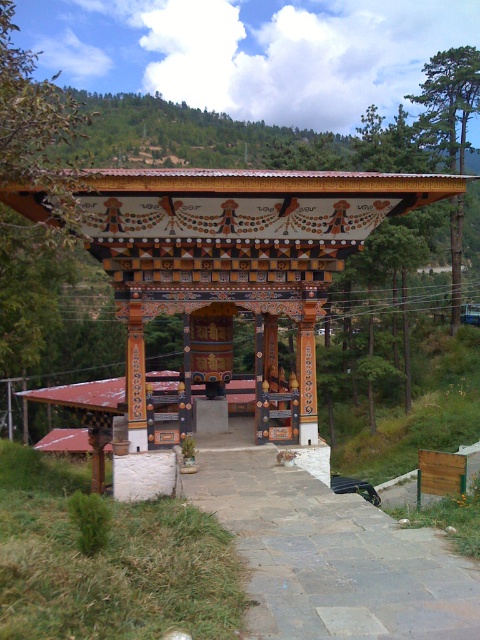
You are planning to host a small gathering in the area shown in the image. You need to choose between placing the event in the painted wood gazebo at center or along the gray stone path at center. Based on their sizes, which location would allow for more guests?

The painted wood gazebo at center is larger in size than the gray stone path at center, so the painted wood gazebo at center can accommodate more guests.

You are standing in the garden of the Bhutanese chorten and want to walk along the gray stone path at center. However, there is a painted wood gazebo at center in your way. Can you walk around the gazebo to access the path?

The gray stone path at center is behind the painted wood gazebo at center, so you can walk around the gazebo to reach the path.

You are standing at the entrance of the traditional Bhutanese chorten and notice a painted wood gazebo at center and a gray stone path at center. Which object is positioned higher in elevation?

The painted wood gazebo at center is above the gray stone path at center, so it is positioned higher in elevation.